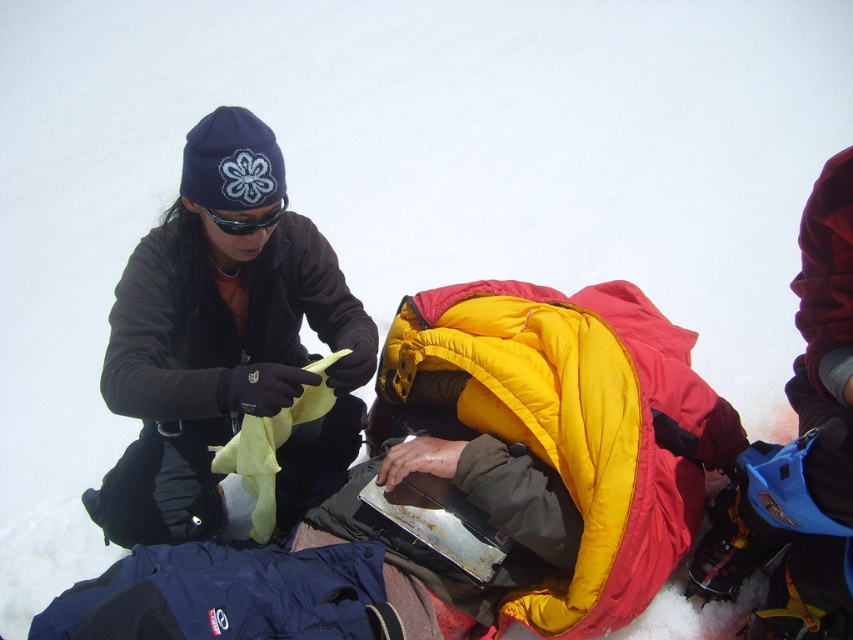
You are a rescue team member observing the scene. You notice the matte black jacket at left and the matte black goggles at upper center. Which object is positioned lower in the image?

The matte black jacket at left is positioned below the matte black goggles at upper center, so the matte black jacket at left is lower in the image.

You are a rescue drone operator trying to locate a person in need of assistance. Your drone is equipped with a camera that can capture images from a certain height. In the image provided, there is a point labeled as point (335, 372). If the drone is flying at an altitude of 6.64 feet, will the camera be able to capture the entire scene around that point clearly?

The distance between point (335, 372) and the camera is exactly 6.64 feet. Since the drone is flying at an altitude of 6.64 feet, the camera should be able to capture the entire scene around that point clearly as the altitude matches the required distance.

You are a hiker preparing to pack your gear. You have a backpack with limited space. You need to place both the matte black jacket at left and the matte black goggles at upper center inside. Based on their sizes, which item should you place first to ensure both fit properly?

The matte black jacket at left is larger than the matte black goggles at upper center, so you should place the matte black jacket at left first to make space for the smaller goggles.